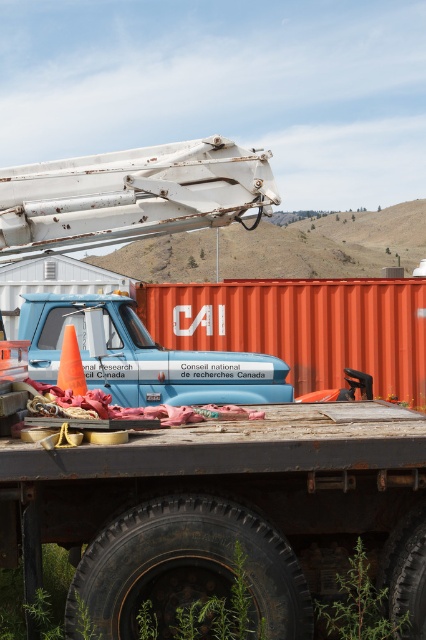
Question: Can you confirm if rusty metal crane arm at upper center is thinner than blue matte pickup truck at center?

Choices:
 (A) yes
 (B) no

Answer: (A)

Question: Can you confirm if rusty metal crane arm at upper center is positioned below blue matte pickup truck at center?

Choices:
 (A) yes
 (B) no

Answer: (B)

Question: Is orange matte shipping container at center positioned at the back of green leafy weed at lower center?

Choices:
 (A) no
 (B) yes

Answer: (B)

Question: Estimate the real-world distances between objects in this image. Which object is closer to the blue matte pickup truck at center?

Choices:
 (A) orange matte traffic cone at lower left
 (B) rusty metal crane arm at upper center
 (C) green leafy weed at lower center

Answer: (B)

Question: Which object is farther from the camera taking this photo?

Choices:
 (A) green leafy weed at lower center
 (B) orange matte traffic cone at lower left
 (C) orange matte shipping container at center

Answer: (C)

Question: Which object appears closest to the camera in this image?

Choices:
 (A) orange matte traffic cone at lower left
 (B) rusty metal crane arm at upper center
 (C) green leafy weed at lower center
 (D) blue matte pickup truck at center

Answer: (C)